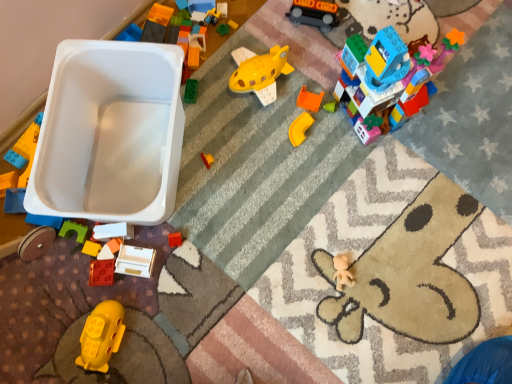
Locate an element on the screen. This screenshot has width=512, height=384. vacant space behind yellow matte plastic corner piece at center-right, acting as the third toy starting from the right is located at coordinates (301, 86).